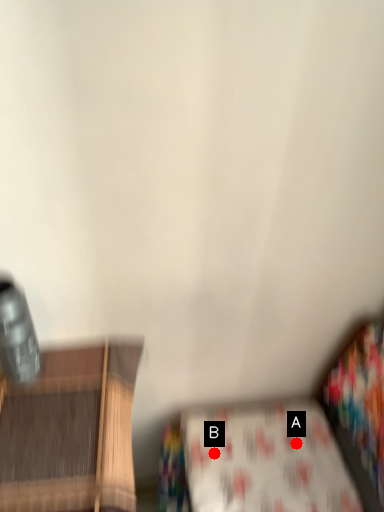
Question: Two points are circled on the image, labeled by A and B beside each circle. Which point appears closest to the camera in this image?

Choices:
 (A) A is closer
 (B) B is closer

Answer: (B)